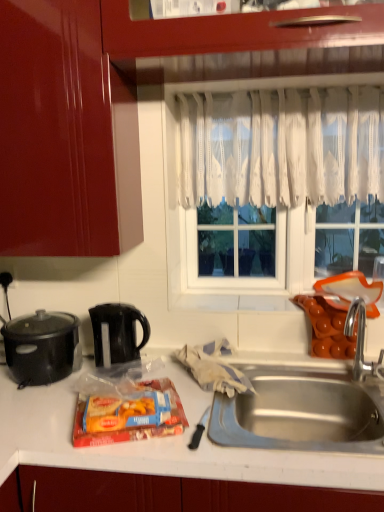
The height and width of the screenshot is (512, 384). Describe the element at coordinates (117, 333) in the screenshot. I see `black plastic kettle at center-left, which is counted as the second kitchen appliance, starting from the left` at that location.

Image resolution: width=384 pixels, height=512 pixels. Describe the element at coordinates (129, 416) in the screenshot. I see `matte plastic snack pack at center` at that location.

Locate an element on the screen. black matte slow cooker at left, the second kitchen appliance in the right-to-left sequence is located at coordinates (42, 347).

From the image's perspective, starting from the matte plastic snack pack at center, which kitchen appliance is the 2nd one above? Please provide its 2D coordinates.

[(117, 333)]

How much distance is there between matte plastic snack pack at center and black plastic kettle at center-left, which is the first kitchen appliance from right to left?

The distance of matte plastic snack pack at center from black plastic kettle at center-left, which is the first kitchen appliance from right to left, is 26.39 centimeters.

From the image's perspective, which is below, matte plastic snack pack at center or black plastic kettle at center-left, which is the first kitchen appliance from right to left?

matte plastic snack pack at center, from the image's perspective.

Is matte plastic snack pack at center inside the boundaries of black plastic kettle at center-left, which is the first kitchen appliance from right to left, or outside?

matte plastic snack pack at center is outside black plastic kettle at center-left, which is the first kitchen appliance from right to left.

Which is in front, point (359, 365) or point (190, 149)?

Positioned in front is point (359, 365).

From the image's perspective, is silver metallic faucet at sink right located above white lace curtain at upper center?

No, from the image's perspective, silver metallic faucet at sink right is not above white lace curtain at upper center.

Where is `curtain above the silver metallic faucet at sink right (from a real-world perspective)`? curtain above the silver metallic faucet at sink right (from a real-world perspective) is located at coordinates (281, 146).

What's the angular difference between silver metallic faucet at sink right and white lace curtain at upper center's facing directions?

The angular difference between silver metallic faucet at sink right and white lace curtain at upper center is 3.51 degrees.

Considering the sizes of objects black matte slow cooker at left, which is the first kitchen appliance in left-to-right order, and white lace curtain at upper center in the image provided, who is taller, black matte slow cooker at left, which is the first kitchen appliance in left-to-right order, or white lace curtain at upper center?

white lace curtain at upper center.

Between black matte slow cooker at left, the second kitchen appliance in the right-to-left sequence, and white lace curtain at upper center, which one has larger width?

Wider between the two is black matte slow cooker at left, the second kitchen appliance in the right-to-left sequence.

Is black matte slow cooker at left, the second kitchen appliance in the right-to-left sequence, not inside white lace curtain at upper center?

A: black matte slow cooker at left, the second kitchen appliance in the right-to-left sequence, is positioned outside white lace curtain at upper center.

Considering the sizes of silver metallic faucet at sink right and white lace curtain at center in the image, is silver metallic faucet at sink right bigger or smaller than white lace curtain at center?

Considering their sizes, silver metallic faucet at sink right takes up less space than white lace curtain at center.

Choose the correct answer: Is silver metallic faucet at sink right inside white lace curtain at center or outside it?

silver metallic faucet at sink right is spatially situated outside white lace curtain at center.

Looking at this image, who is taller, silver metallic faucet at sink right or white lace curtain at center?

With more height is white lace curtain at center.

In terms of size, does silver metallic faucet at sink right appear bigger or smaller than matte plastic snack pack at center?

Considering their sizes, silver metallic faucet at sink right takes up more space than matte plastic snack pack at center.

Relative to matte plastic snack pack at center, is silver metallic faucet at sink right in front or behind?

Clearly, silver metallic faucet at sink right is behind matte plastic snack pack at center.

Does silver metallic faucet at sink right have a greater width compared to matte plastic snack pack at center?

No.

Do you think silver metallic faucet at sink right is within matte plastic snack pack at center, or outside of it?

silver metallic faucet at sink right is located beyond the bounds of matte plastic snack pack at center.

How distant is white lace curtain at upper center from matte plastic snack pack at center?

38.29 inches.

Who is bigger, white lace curtain at upper center or matte plastic snack pack at center?

Bigger between the two is white lace curtain at upper center.

Consider the image. Is white lace curtain at upper center to the right of matte plastic snack pack at center from the viewer's perspective?

Indeed, white lace curtain at upper center is positioned on the right side of matte plastic snack pack at center.

From the image's perspective, is white lace curtain at upper center above matte plastic snack pack at center?

Yes, from the image's perspective, white lace curtain at upper center is over matte plastic snack pack at center.

Between white lace curtain at upper center and black plastic kettle at center-left, which is counted as the second kitchen appliance, starting from the left, which one is positioned behind?

white lace curtain at upper center is further from the camera.

Between white lace curtain at upper center and black plastic kettle at center-left, which is the first kitchen appliance from right to left, which one has larger width?

With larger width is black plastic kettle at center-left, which is the first kitchen appliance from right to left.

Is white lace curtain at upper center taller or shorter than black plastic kettle at center-left, which is the first kitchen appliance from right to left?

Considering their sizes, white lace curtain at upper center has more height than black plastic kettle at center-left, which is the first kitchen appliance from right to left.

From the picture: Is white lace curtain at upper center not inside black plastic kettle at center-left, which is the first kitchen appliance from right to left?

Yes, white lace curtain at upper center is not within black plastic kettle at center-left, which is the first kitchen appliance from right to left.

You are a GUI agent. You are given a task and a screenshot of the screen. Output one action in this format:
    pyautogui.click(x=<x>, y=<y>)
    Task: Click on the snack lying below the black plastic kettle at center-left, which is counted as the second kitchen appliance, starting from the left (from the image's perspective)
    This screenshot has width=384, height=512.
    Given the screenshot: What is the action you would take?
    pyautogui.click(x=129, y=416)

Where is `curtain located on the left of silver metallic faucet at sink right`? curtain located on the left of silver metallic faucet at sink right is located at coordinates (x=281, y=146).

Based on their spatial positions, is black plastic kettle at center-left, which is the first kitchen appliance from right to left, or white lace curtain at upper center further from silver metallic faucet at sink right?

black plastic kettle at center-left, which is the first kitchen appliance from right to left, lies further to silver metallic faucet at sink right than the other object.

When comparing their distances from black plastic kettle at center-left, which is counted as the second kitchen appliance, starting from the left, does matte plastic snack pack at center or white lace curtain at upper center seem further?

white lace curtain at upper center.

Which object lies nearer to the anchor point matte plastic snack pack at center, black matte slow cooker at left, which is the first kitchen appliance in left-to-right order, or black plastic kettle at center-left, which is the first kitchen appliance from right to left?

black plastic kettle at center-left, which is the first kitchen appliance from right to left, is positioned closer to the anchor matte plastic snack pack at center.

In the scene shown: Based on their spatial positions, is matte plastic snack pack at center or black matte slow cooker at left, which is the first kitchen appliance in left-to-right order, further from black plastic kettle at center-left, which is the first kitchen appliance from right to left?

matte plastic snack pack at center is positioned further to the anchor black plastic kettle at center-left, which is the first kitchen appliance from right to left.

Based on the photo, based on their spatial positions, is black plastic kettle at center-left, which is the first kitchen appliance from right to left, or silver metallic faucet at sink right further from white lace curtain at center?

silver metallic faucet at sink right is further to white lace curtain at center.

Which object lies further to the anchor point white lace curtain at upper center, black matte slow cooker at left, which is the first kitchen appliance in left-to-right order, or silver metallic faucet at sink right?

The object further to white lace curtain at upper center is black matte slow cooker at left, which is the first kitchen appliance in left-to-right order.

From the image, which object appears to be nearer to black matte slow cooker at left, which is the first kitchen appliance in left-to-right order, silver metallic faucet at sink right or matte plastic snack pack at center?

Based on the image, matte plastic snack pack at center appears to be nearer to black matte slow cooker at left, which is the first kitchen appliance in left-to-right order.

Based on their spatial positions, is white lace curtain at center or matte plastic snack pack at center closer to silver metallic faucet at sink right?

Among the two, white lace curtain at center is located nearer to silver metallic faucet at sink right.

Find the location of a particular element. window frame located between matte plastic snack pack at center and silver metallic faucet at sink right in the left-right direction is located at coordinates [x=263, y=181].

Identify the location of curtain situated between black plastic kettle at center-left, which is counted as the second kitchen appliance, starting from the left, and silver metallic faucet at sink right from left to right. This screenshot has width=384, height=512. (281, 146).

Locate an element on the screen. The image size is (384, 512). snack situated between black matte slow cooker at left, which is the first kitchen appliance in left-to-right order, and silver metallic faucet at sink right from left to right is located at coordinates (129, 416).

I want to click on curtain between black matte slow cooker at left, the second kitchen appliance in the right-to-left sequence, and white lace curtain at center, in the horizontal direction, so click(281, 146).